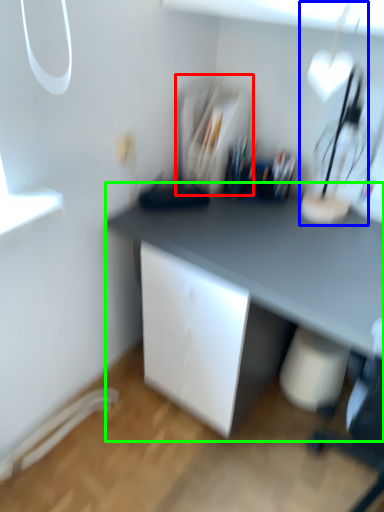
Question: Which is farther away from shelf (highlighted by a red box)? table lamp (highlighted by a blue box) or desk (highlighted by a green box)?

Choices:
 (A) table lamp
 (B) desk

Answer: (A)